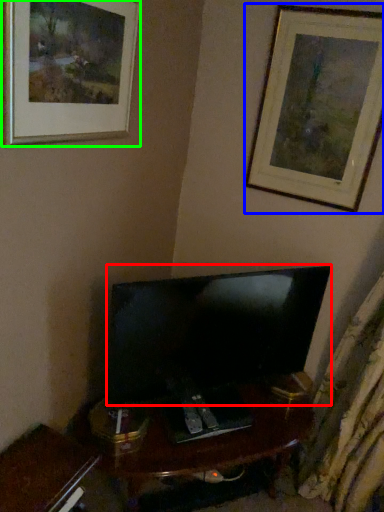
Question: Which object is the closest to the television (highlighted by a red box)? Choose among these: picture frame (highlighted by a blue box) or picture frame (highlighted by a green box).

Choices:
 (A) picture frame
 (B) picture frame

Answer: (A)